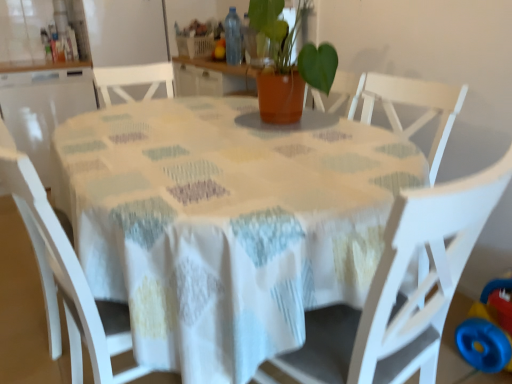
Question: Is transparent plastic bottle at center bigger or smaller than white matte chair at left, acting as the first chair starting from the left?

Choices:
 (A) small
 (B) big

Answer: (A)

Question: Looking at their shapes, would you say transparent plastic bottle at center is wider or thinner than white matte chair at left, the second chair viewed from the right?

Choices:
 (A) thin
 (B) wide

Answer: (A)

Question: Considering the real-world distances, which object is closest to the white wood chair at center, which is the 2th chair from left to right?

Choices:
 (A) terracotta pot at center
 (B) transparent plastic bottle at center
 (C) blue plastic toy at lower right
 (D) white matte chair at left, acting as the first chair starting from the left
 (E) white fabric table at center

Answer: (E)

Question: Which of these objects is positioned closest to the blue plastic toy at lower right?

Choices:
 (A) white fabric table at center
 (B) terracotta pot at center
 (C) white matte chair at left, the second chair viewed from the right
 (D) white wood chair at center, the first chair when ordered from right to left
 (E) transparent plastic bottle at center

Answer: (D)